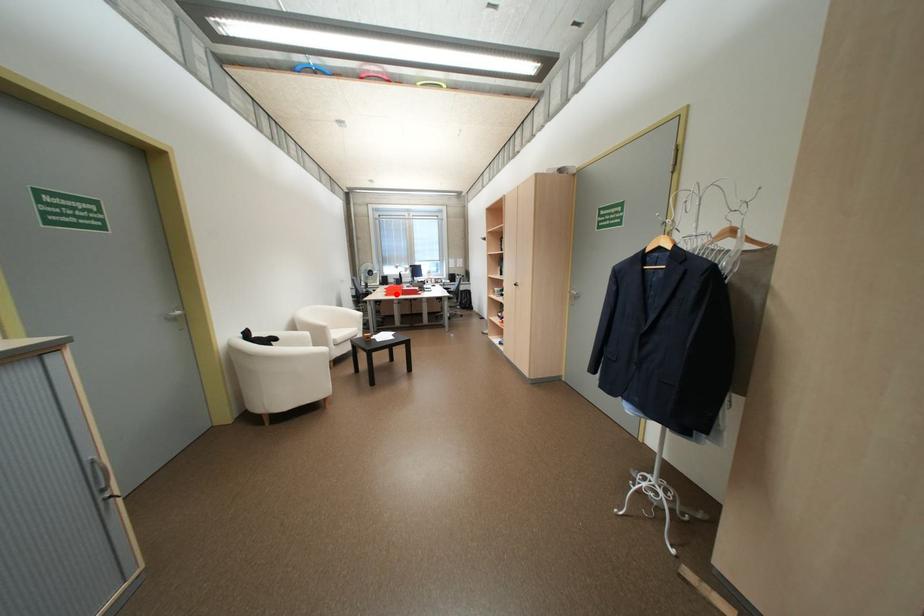
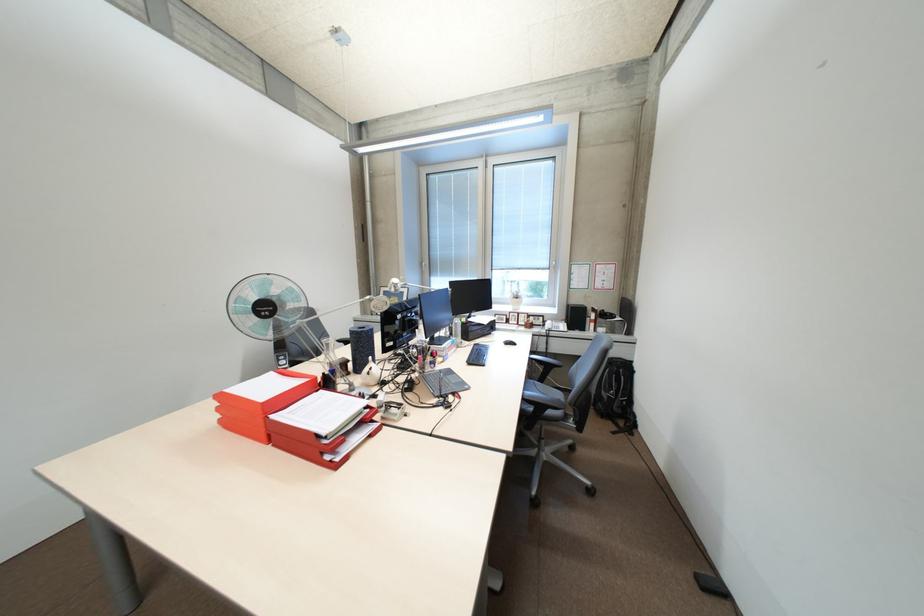
The point at the highlighted location is marked in the first image. Where is the corresponding point in the second image?

(231, 421)